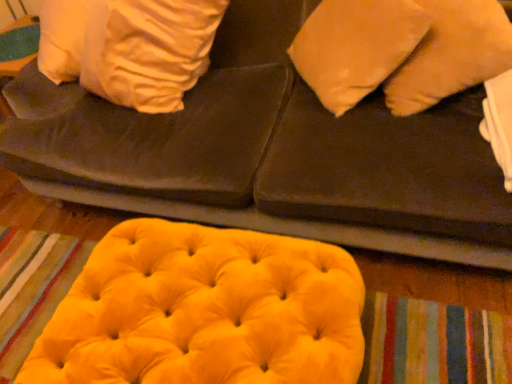
Where is `vacant area on top of velvet yellow bean bag at lower center (from a real-world perspective)`? The width and height of the screenshot is (512, 384). vacant area on top of velvet yellow bean bag at lower center (from a real-world perspective) is located at coordinates (180, 301).